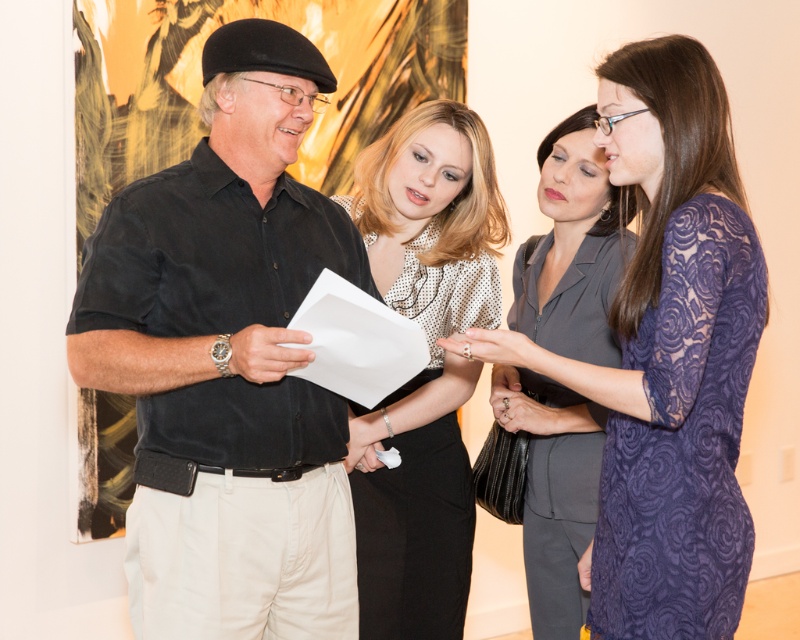
Based on the photo, you are a photographer standing at the camera position. You want to take a closeup of the lace fabric dress at center without moving the dress. Can you zoom in enough to capture the lace details?

The lace fabric dress at center is 1.49 meters from camera, so yes, you can zoom in enough to capture the lace details without moving the dress.

You are a photographer trying to capture a group photo of the black cotton shirt at center and the matte gray suit at center. The camera you are using has a maximum focus range of 30 inches. Can you take a photo of both subjects without moving them?

The black cotton shirt at center is 29.50 inches from the matte gray suit at center, so yes, the camera can focus on both subjects since the distance between them is within the 30 inches range.

Where is the polka dot blouse at center located in the image?

The polka dot blouse at center is located at point (425,368).